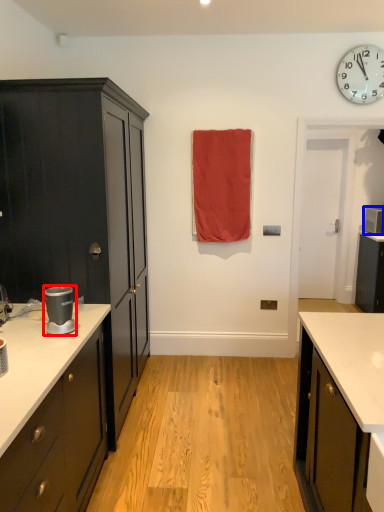
Question: Among these objects, which one is farthest to the camera, appliance (highlighted by a red box) or appliance (highlighted by a blue box)?

Choices:
 (A) appliance
 (B) appliance

Answer: (B)